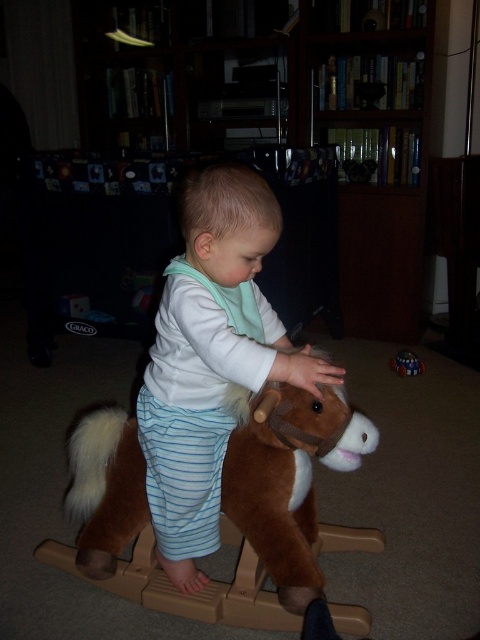
Describe the element at coordinates (286, 115) in the screenshot. I see `wooden bookshelf at upper center` at that location.

Where is `wooden bookshelf at upper center`? wooden bookshelf at upper center is located at coordinates (286, 115).

Can you confirm if white soft toddler at center is positioned below shiny metallic ball at center?

No, white soft toddler at center is not below shiny metallic ball at center.

Does white soft toddler at center lie behind shiny metallic ball at center?

No, white soft toddler at center is closer to the viewer.

Does point (172, 307) come farther from viewer compared to point (396, 355)?

No, it is in front of (396, 355).

This screenshot has height=640, width=480. In order to click on white soft toddler at center in this screenshot , I will do `click(211, 358)`.

Does wooden bookshelf at upper center have a lesser height compared to shiny metallic ball at center?

No.

You are a GUI agent. You are given a task and a screenshot of the screen. Output one action in this format:
    pyautogui.click(x=<x>, y=<y>)
    Task: Click on the wooden bookshelf at upper center
    
    Given the screenshot: What is the action you would take?
    pyautogui.click(x=286, y=115)

Does point (345, 48) come farther from viewer compared to point (408, 371)?

Yes, it is.

You are a GUI agent. You are given a task and a screenshot of the screen. Output one action in this format:
    pyautogui.click(x=<x>, y=<y>)
    Task: Click on the wooden bookshelf at upper center
    
    Given the screenshot: What is the action you would take?
    pyautogui.click(x=286, y=115)